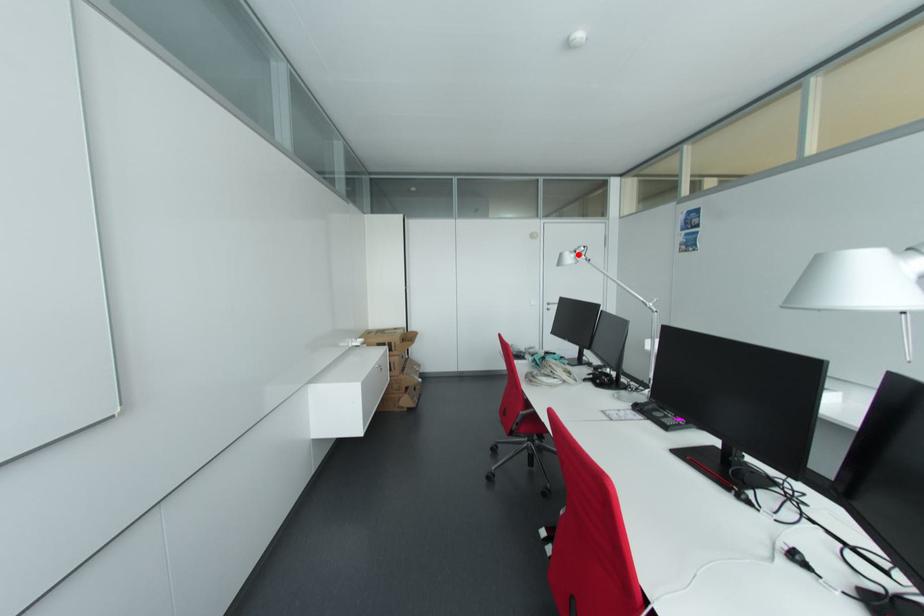
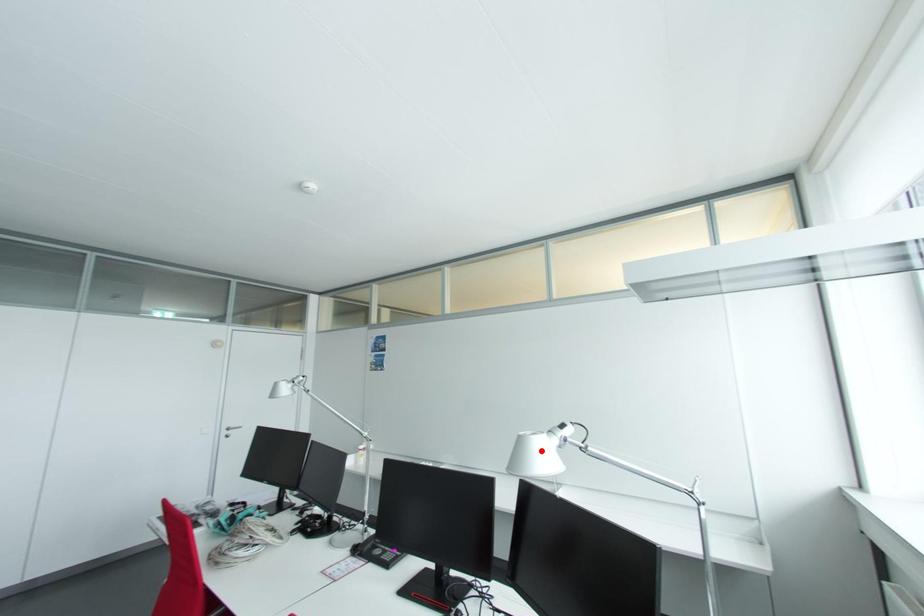
I am providing you with two images of the same scene from different viewpoints. A red point is marked on the first image and another point is marked on the second image. Does the point marked in image1 correspond to the same location as the one in image2?

No